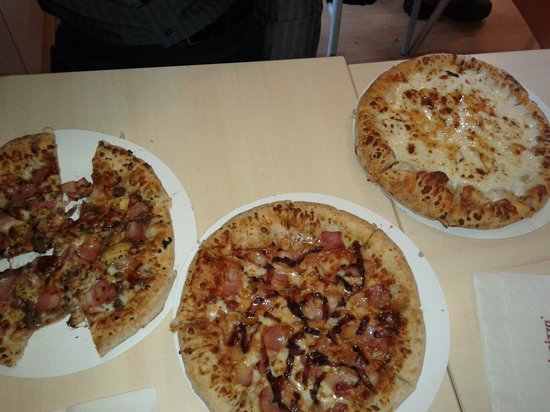
Find the location of a particular element. The width and height of the screenshot is (550, 412). box is located at coordinates (520, 334).